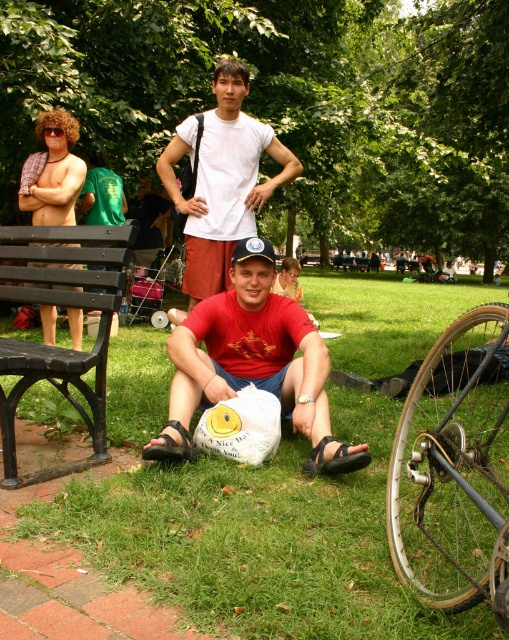
What is the color of the clothing item located at the coordinates point [252,364] in the image?

The point [252,364] indicates the matte red t shirt at center, so the color is red.